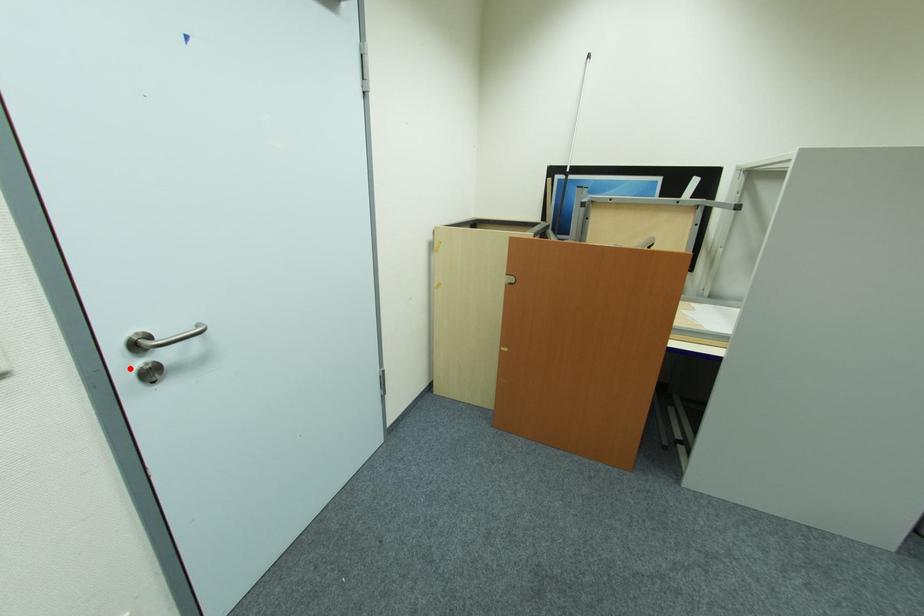
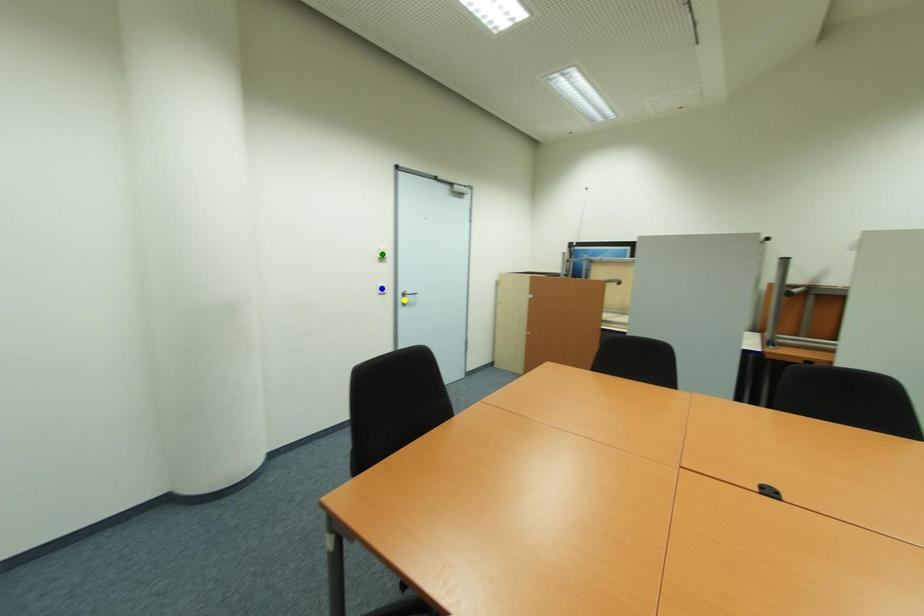
Question: I am providing you with two images of the same scene from different viewpoints. A red point is marked on the first image. You are given multiple points on the second image. Which point in image 2 represents the same 3d spot as the red point in image 1?

Choices:
 (A) blue point
 (B) green point
 (C) yellow point

Answer: (C)